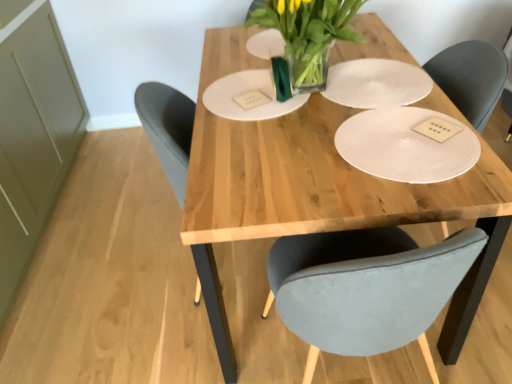
Where is `vacant area that is situated to the right of white matte paper plate at center, which is counted as the 1th paper plate, starting from the left`? vacant area that is situated to the right of white matte paper plate at center, which is counted as the 1th paper plate, starting from the left is located at coordinates (359, 86).